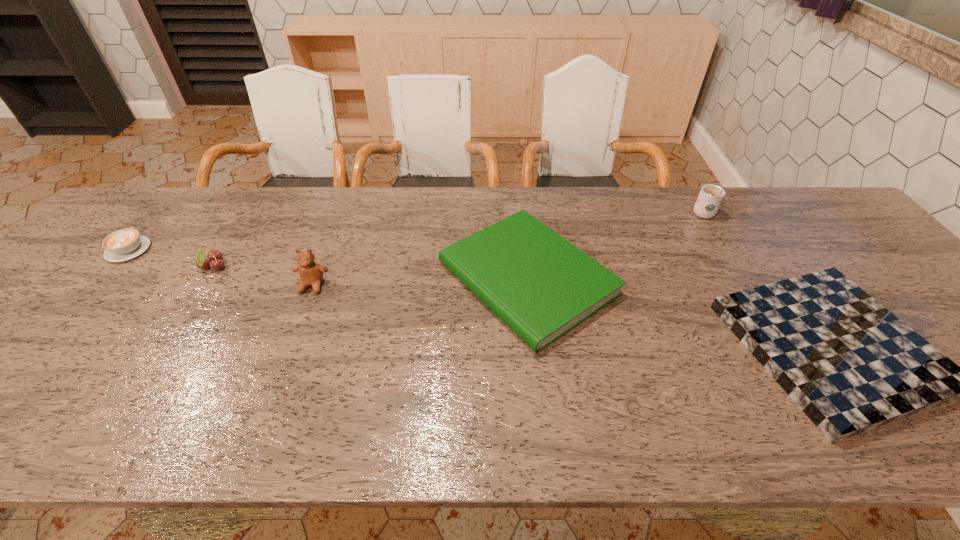
Find the location of a particular element. The image size is (960, 540). free spot between the cup and the cherry is located at coordinates (458, 239).

At what (x,y) coordinates should I click in order to perform the action: click on free spot between the cherry and the cup. Please return your answer as a coordinate pair (x, y). Image resolution: width=960 pixels, height=540 pixels. Looking at the image, I should click on click(x=458, y=239).

Find the location of a particular element. free spot between the second object from left to right and the paperback book is located at coordinates (371, 273).

Where is `free space between the cup and the third tallest object`? Image resolution: width=960 pixels, height=540 pixels. free space between the cup and the third tallest object is located at coordinates (458, 239).

Find the location of a particular element. vacant point located between the fifth object from right to left and the teddy bear is located at coordinates (263, 276).

Identify which object is located as the second nearest to the paperback book. Please provide its 2D coordinates. Your answer should be formatted as a tuple, i.e. [(x, y)], where the tuple contains the x and y coordinates of a point satisfying the conditions above.

[(311, 273)]

Point out which object is positioned as the fifth nearest to the cappuccino. Please provide its 2D coordinates. Your answer should be formatted as a tuple, i.e. [(x, y)], where the tuple contains the x and y coordinates of a point satisfying the conditions above.

[(710, 197)]